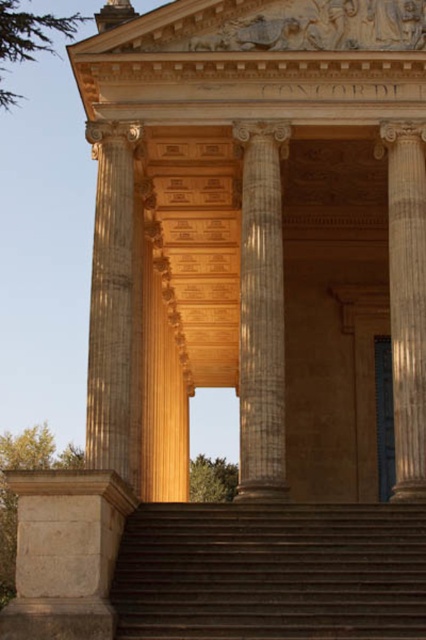
You are an architect assessing the structural integrity of the entrance. Given that the smooth beige column at center and the smooth stone column at right are both supporting the pediment, which column might be more critical to the structure if one were to fail?

The smooth beige column at center is taller than the smooth stone column at right. Since taller columns generally bear more weight in classical structures, the smooth beige column at center might be more critical to the structure if one were to fail.

You are standing at the entrance of a classical temple and want to reach the top of the brown stone stairs at center. There is a point marked at coordinates point (x=270, y=572). Is this point located on the stairs you need to climb?

Yes, the point (x=270, y=572) is on the brown stone stairs at center, so it is part of the stairs you need to climb.

You are an architect examining the entrance of a classical building. You notice the smooth beige column at center and the smooth stone column at right. Based on their positions, which column would you say is closer to the triangular pediment?

The smooth beige column at center is above the smooth stone column at right, so it is closer to the triangular pediment.